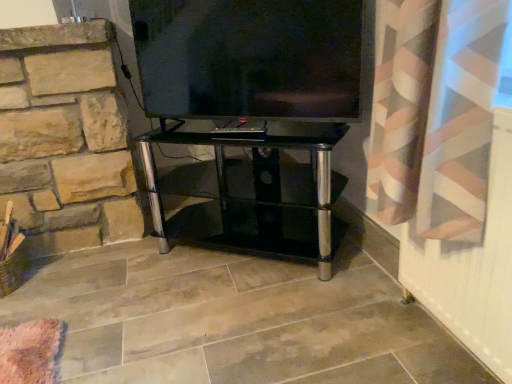
Image resolution: width=512 pixels, height=384 pixels. In order to click on vacant space underneath flat screen tv at center (from a real-world perspective) in this screenshot , I will do `click(239, 127)`.